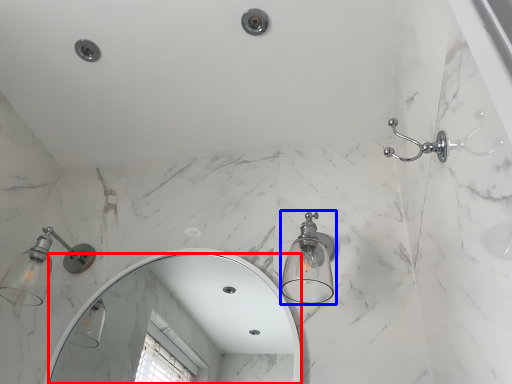
Question: Which object is closer to the camera taking this photo, mirror (highlighted by a red box) or light fixture (highlighted by a blue box)?

Choices:
 (A) mirror
 (B) light fixture

Answer: (B)